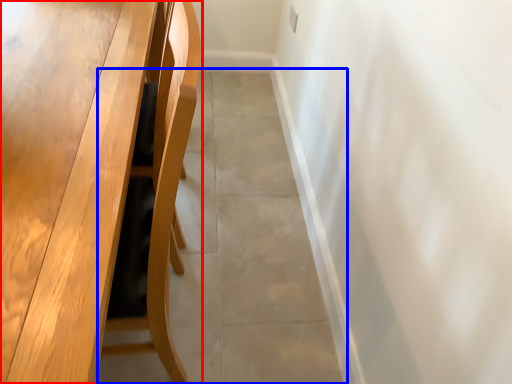
Question: Which point is further to the camera, table (highlighted by a red box) or concrete (highlighted by a blue box)?

Choices:
 (A) table
 (B) concrete

Answer: (B)